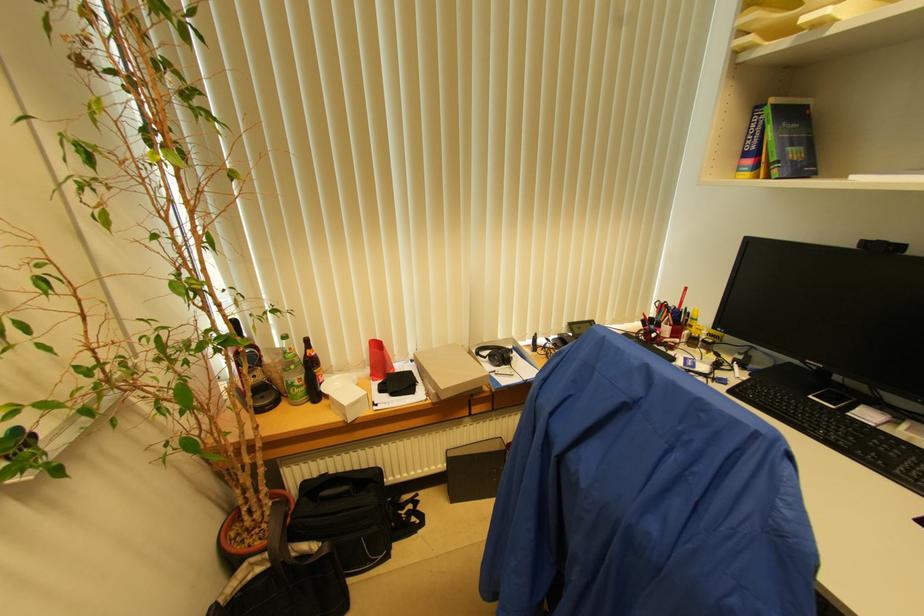
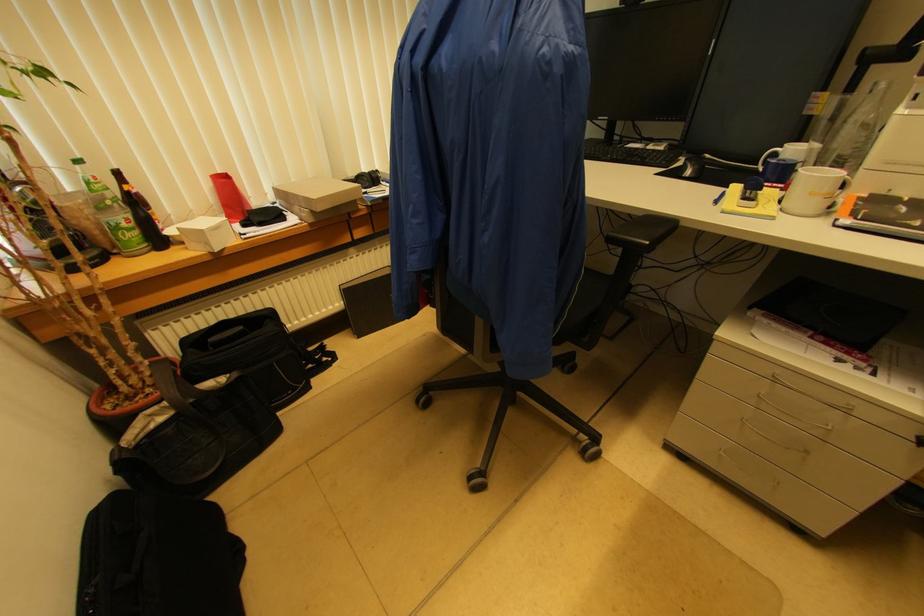
Where in the second image is the point corresponding to the point at 273,561 from the first image?

(175, 408)